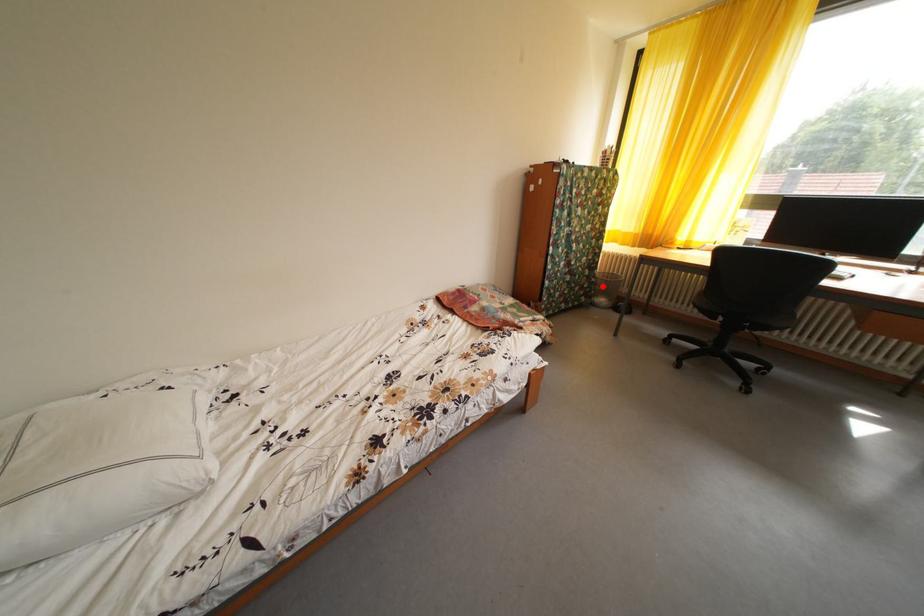
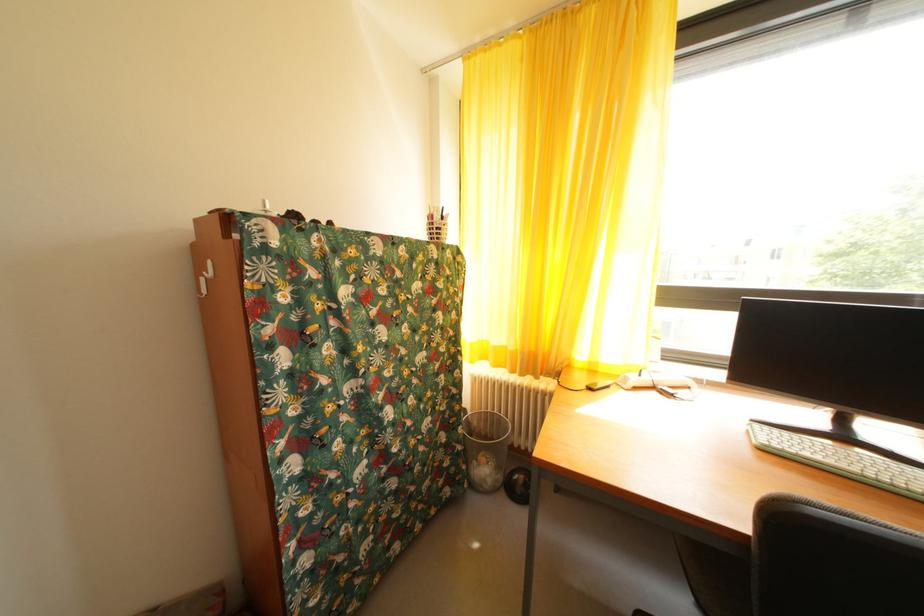
The point at the highlighted location is marked in the first image. Where is the corresponding point in the second image?

(468, 454)